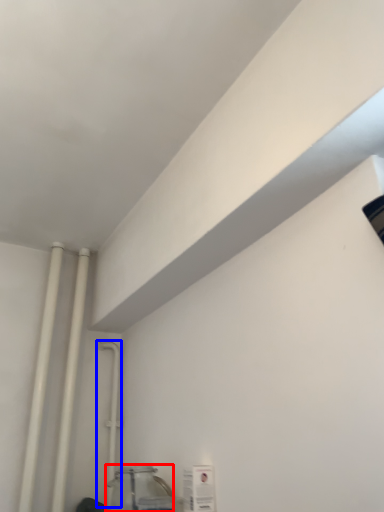
Question: Among these objects, which one is nearest to the camera, glass jar (highlighted by a red box) or pipe (highlighted by a blue box)?

Choices:
 (A) glass jar
 (B) pipe

Answer: (A)